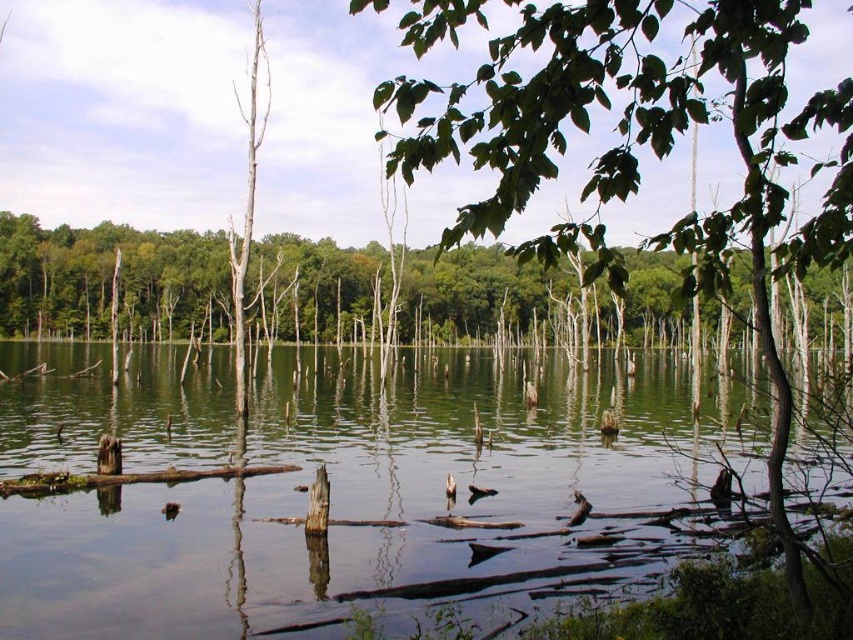
You are standing on the lakeside and want to take a photo of the green reflective water at center. Where should you position your camera to capture it in the frame?

The green reflective water at center is located at the 2D coordinates point [329,480], so position your camera at that point to capture it in the frame.

You are standing on a wooden dock and looking at the green reflective water at center and the green matte tree at center. Which object appears narrower in the scene?

The green reflective water at center is thinner than the green matte tree at center, so the green reflective water at center appears narrower.

You are a photographer trying to capture the green leafy tree at upper center and the green reflective water at center in your shot. Which object will appear closer to the top of your photo?

The green leafy tree at upper center will appear closer to the top of the photo because it is taller than the green reflective water at center.